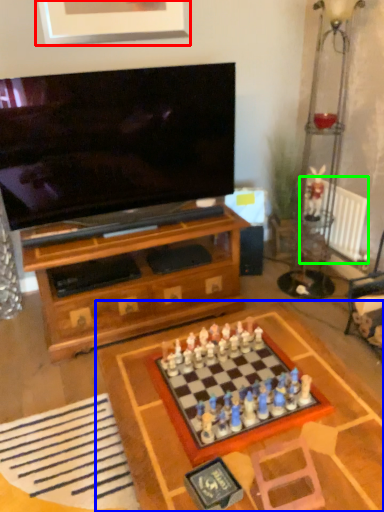
Question: Estimate the real-world distances between objects in this image. Which object is farther from picture frame (highlighted by a red box), table (highlighted by a blue box) or radiator (highlighted by a green box)?

Choices:
 (A) table
 (B) radiator

Answer: (A)